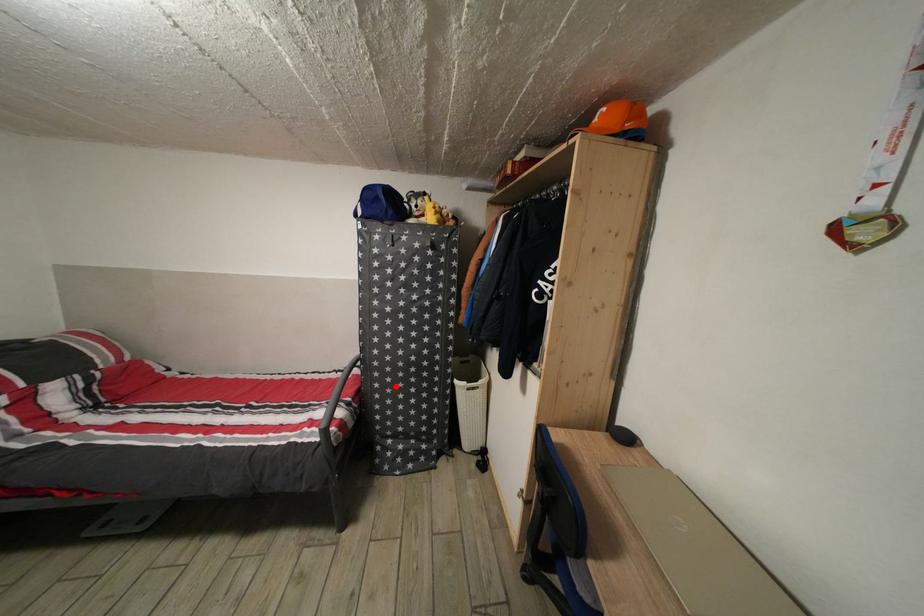
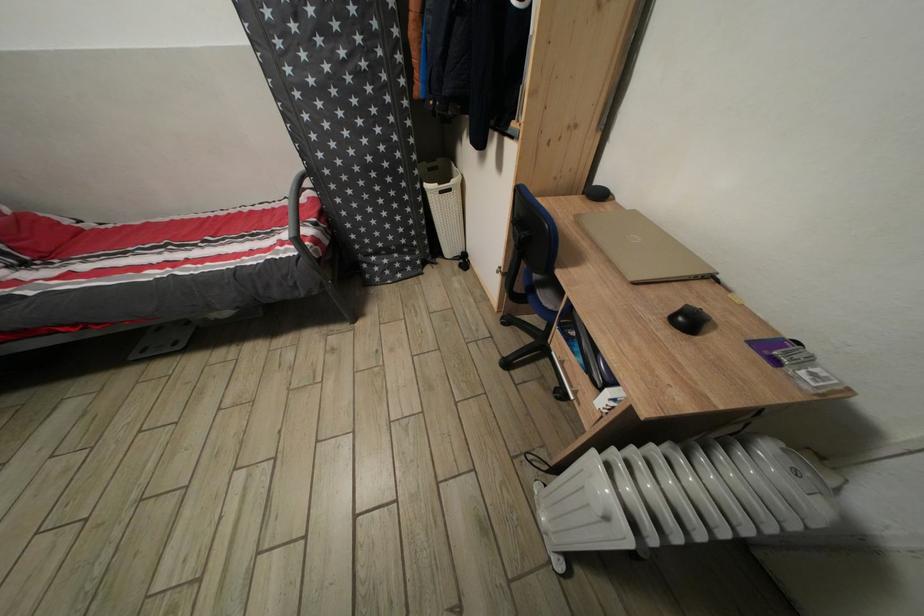
Question: I am providing you with two images of the same scene from different viewpoints. In image1, a red point is highlighted. Considering the same 3D point in image2, which of the following is correct?

Choices:
 (A) It is closer
 (B) It is farther

Answer: (A)